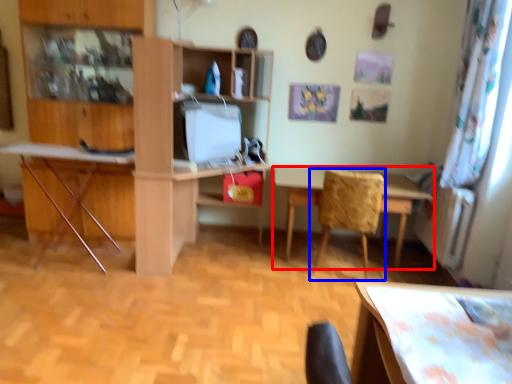
Question: Which point is closer to the camera, table (highlighted by a red box) or chair (highlighted by a blue box)?

Choices:
 (A) table
 (B) chair

Answer: (B)